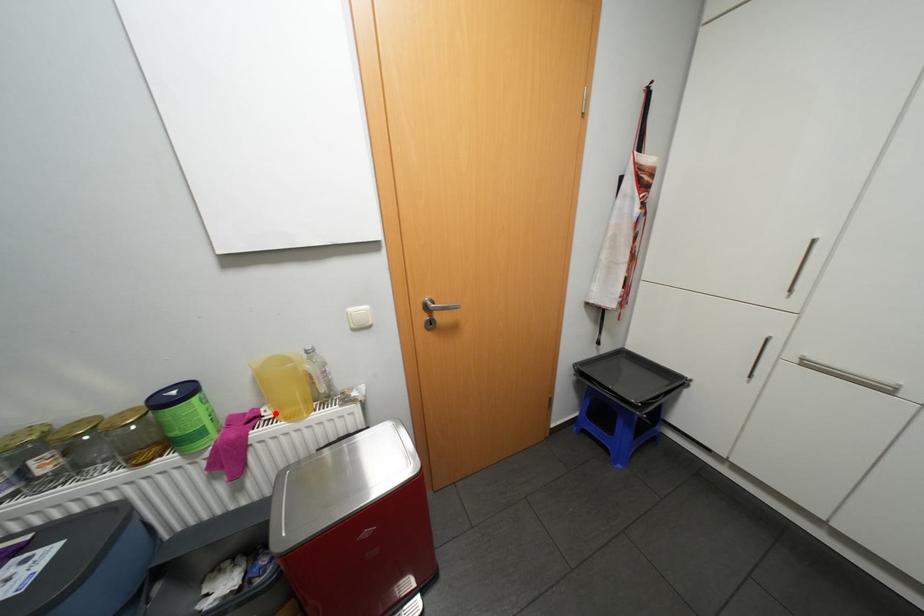
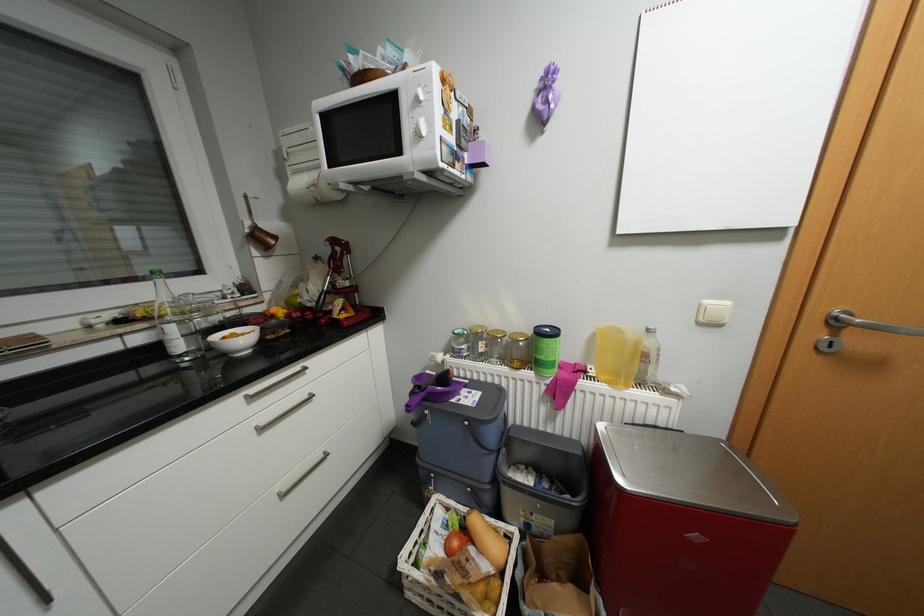
Locate, in the second image, the point that corresponds to the highlighted location in the first image.

(600, 371)